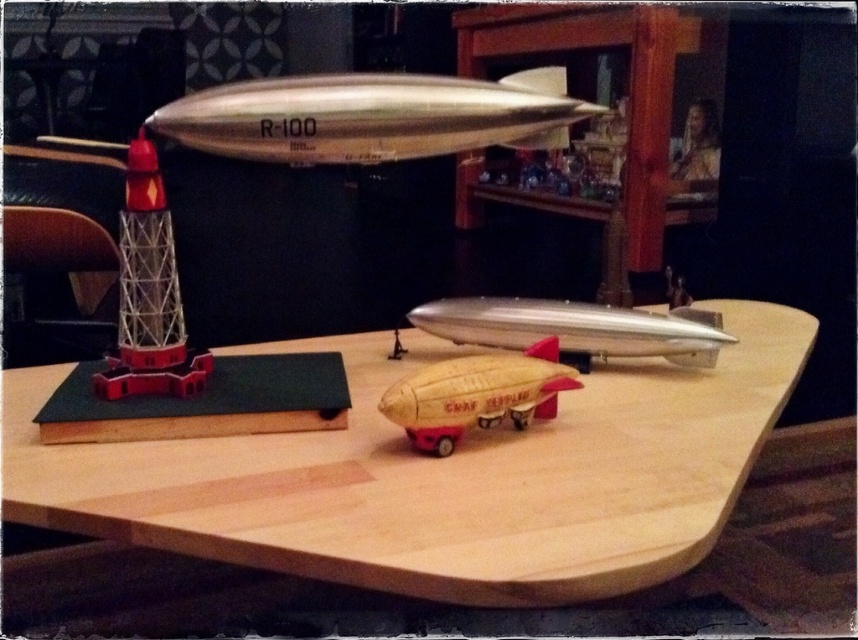
Question: Does metallic silver rocket at upper center come in front of metallic silver airship at upper center?

Choices:
 (A) no
 (B) yes

Answer: (B)

Question: Is wooden table at center bigger than silver metallic airplane at center?

Choices:
 (A) no
 (B) yes

Answer: (B)

Question: Among these points, which one is farthest from the camera?

Choices:
 (A) (514, 300)
 (B) (702, 138)
 (C) (619, 593)
 (D) (390, 152)

Answer: (B)

Question: Among these points, which one is farthest from the camera?

Choices:
 (A) (180, 308)
 (B) (434, 401)

Answer: (A)

Question: Can you confirm if wooden table at center is wider than metallic silver rocket at upper center?

Choices:
 (A) no
 (B) yes

Answer: (B)

Question: Which of the following is the closest to the observer?

Choices:
 (A) (275, 161)
 (B) (427, 307)
 (C) (687, 148)
 (D) (541, 346)

Answer: (D)